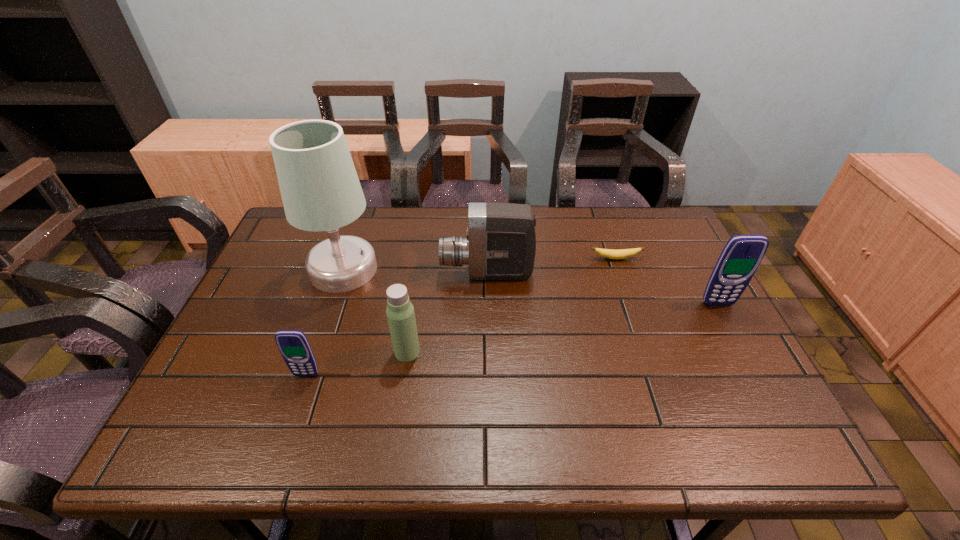
This screenshot has width=960, height=540. I want to click on vacant point at the near right corner, so click(x=713, y=410).

The width and height of the screenshot is (960, 540). I want to click on blank region between the thermos bottle and the right cellular telephone, so click(x=563, y=328).

You are a GUI agent. You are given a task and a screenshot of the screen. Output one action in this format:
    pyautogui.click(x=<x>, y=<y>)
    Task: Click on the vacant region between the tallest object and the thermos bottle
    
    Given the screenshot: What is the action you would take?
    pyautogui.click(x=375, y=310)

Locate an element on the screen. The width and height of the screenshot is (960, 540). blank region between the lampshade and the left cellular telephone is located at coordinates (324, 322).

Locate an element on the screen. Image resolution: width=960 pixels, height=540 pixels. empty space that is in between the third object from right to left and the fourth object from right to left is located at coordinates (447, 313).

Locate an element on the screen. Image resolution: width=960 pixels, height=540 pixels. free spot between the lampshade and the thermos bottle is located at coordinates (375, 310).

The image size is (960, 540). In order to click on empty space between the nearer cellular telephone and the second nearest object in this screenshot , I will do `click(357, 363)`.

Identify which object is located as the third nearest to the rightmost object. Please provide its 2D coordinates. Your answer should be formatted as a tuple, i.e. [(x, y)], where the tuple contains the x and y coordinates of a point satisfying the conditions above.

[(400, 313)]

The height and width of the screenshot is (540, 960). Identify the location of object that is the fourth closest to the camcorder. (294, 347).

The width and height of the screenshot is (960, 540). In order to click on vacant space that satisfies the following two spatial constraints: 1. on the back side of the fifth farthest object; 2. on the right side of the shortest object in this screenshot , I will do `click(421, 259)`.